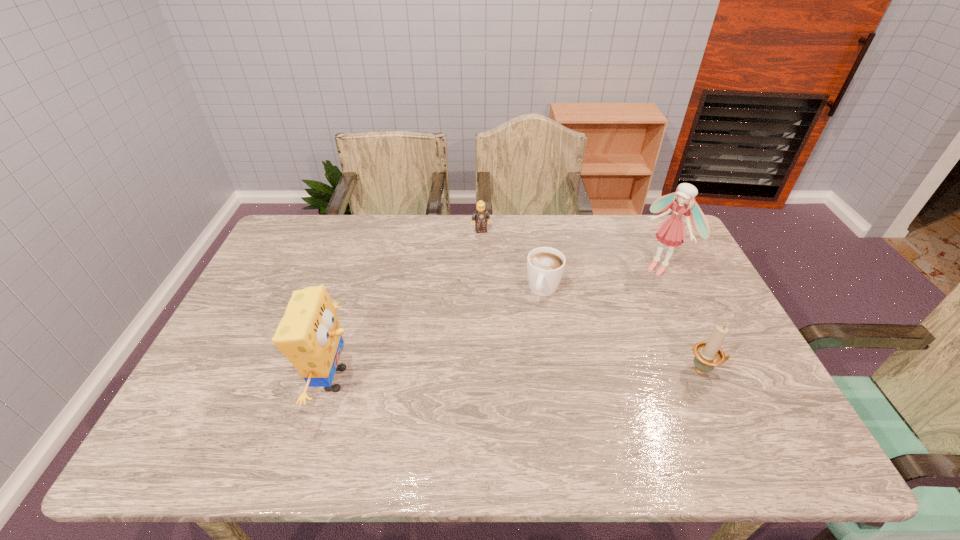
The height and width of the screenshot is (540, 960). In order to click on candle_holder positioned at the right edge in this screenshot , I will do `click(708, 354)`.

The width and height of the screenshot is (960, 540). I want to click on doll present at the right edge, so pyautogui.click(x=671, y=232).

At what (x,y) coordinates should I click in order to perform the action: click on object present at the far right corner. Please return your answer as a coordinate pair (x, y). Image resolution: width=960 pixels, height=540 pixels. Looking at the image, I should click on (671, 232).

This screenshot has width=960, height=540. Identify the location of vacant space at the far edge of the desktop. (509, 252).

The height and width of the screenshot is (540, 960). I want to click on vacant space at the near edge of the desktop, so click(x=400, y=411).

Find the location of a particular element. free space at the left edge is located at coordinates (277, 265).

Find the location of a particular element. The width and height of the screenshot is (960, 540). blank space at the right edge of the desktop is located at coordinates (666, 307).

Where is `blank space at the far left corner of the desktop`? The image size is (960, 540). blank space at the far left corner of the desktop is located at coordinates (298, 251).

Find the location of `empty location between the cappuccino and the sponge`. empty location between the cappuccino and the sponge is located at coordinates (439, 335).

Identify the location of free space between the tallest object and the third object from left to right. The height and width of the screenshot is (540, 960). (602, 279).